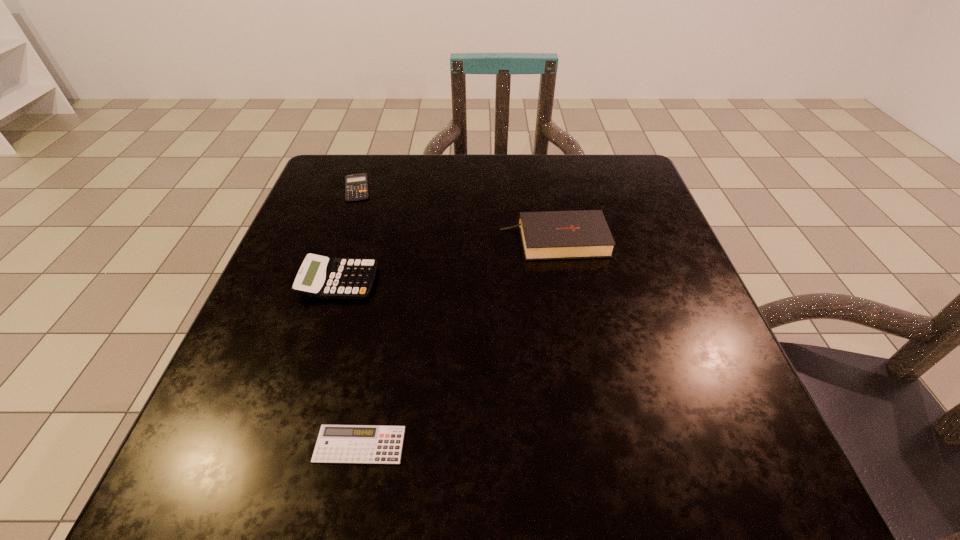
This screenshot has height=540, width=960. I want to click on vacant region located on the front of the farthest object, so click(x=321, y=292).

This screenshot has width=960, height=540. Find the location of `free space located on the right of the nearest calculator`. free space located on the right of the nearest calculator is located at coordinates (469, 444).

Image resolution: width=960 pixels, height=540 pixels. What are the coordinates of `object that is at the far edge` in the screenshot? It's located at (356, 185).

Image resolution: width=960 pixels, height=540 pixels. Identify the location of object that is positioned at the near edge. (336, 443).

Identify the location of object that is positioned at the right edge. [550, 235].

Image resolution: width=960 pixels, height=540 pixels. I want to click on object that is at the far left corner, so click(356, 185).

Where is `blank space at the far edge`? The width and height of the screenshot is (960, 540). blank space at the far edge is located at coordinates (551, 174).

I want to click on vacant space at the near edge, so click(626, 478).

At what (x,y) coordinates should I click in order to perform the action: click on free space at the left edge of the desktop. Please return your answer as a coordinate pair (x, y). Looking at the image, I should click on 327,334.

Where is `free region at the right edge`? This screenshot has width=960, height=540. free region at the right edge is located at coordinates (633, 262).